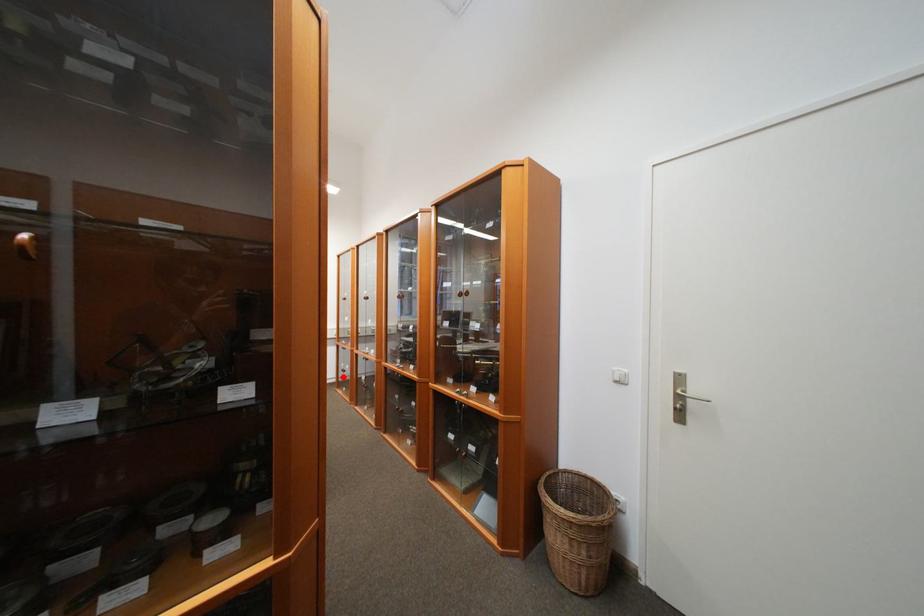
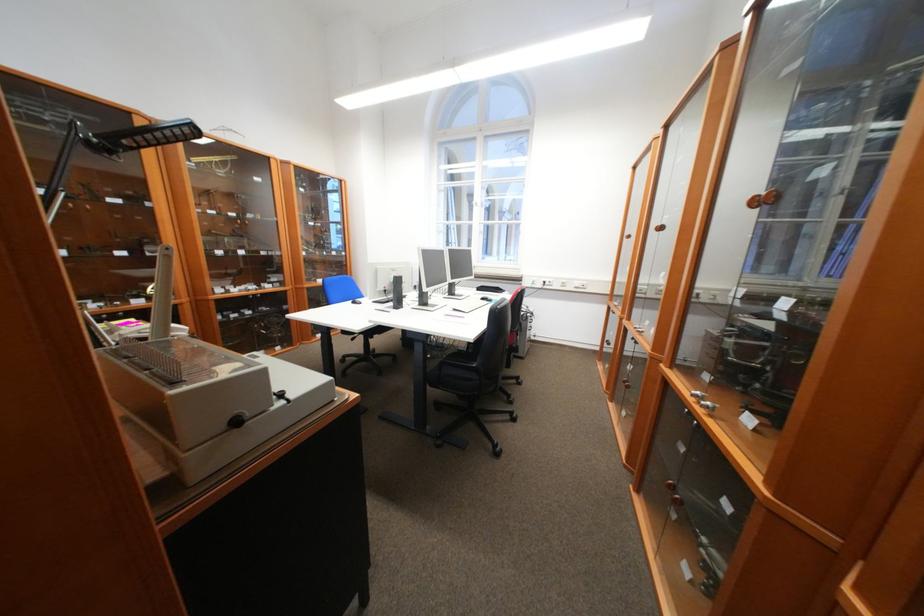
Where in the second image is the point corresponding to the highlighted location from the first image?

(609, 345)